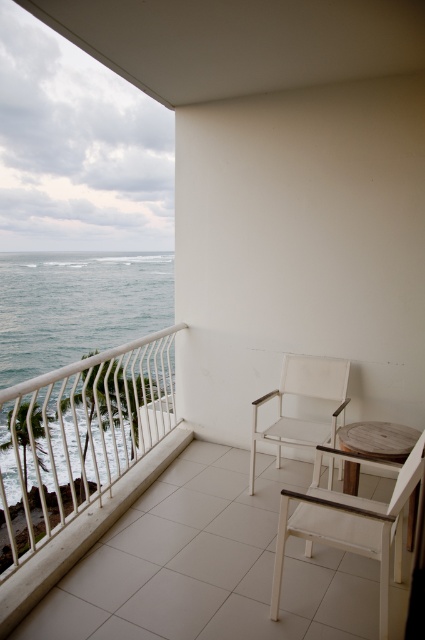
You are standing on the balcony and want to sit down. There are two options available to you. The first is the white wood chair at lower right, and the second is the wooden table at center. Which of these two items is positioned to the left of the other?

The white wood chair at lower right is to the left of wooden table at center.

In the scene shown: You are sitting on the white wood chair at lower right and want to place a book on the wooden table at center. Can you reach the table from your current position?

The white wood chair at lower right is positioned under the wooden table at center, so yes, you can easily reach the table from your current position.